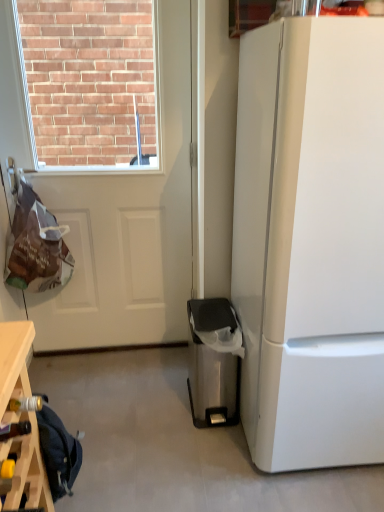
In order to face wooden wine rack at lower left, should I rotate leftwards or rightwards?

It's best to rotate left around 19.871 degrees.

I want to click on white matte door at upper left, so click(x=128, y=225).

You are a GUI agent. You are given a task and a screenshot of the screen. Output one action in this format:
    pyautogui.click(x=<x>, y=<y>)
    Task: Click on the stainless steel trash can at lower right
    The height and width of the screenshot is (512, 384).
    Given the screenshot: What is the action you would take?
    pyautogui.click(x=214, y=361)

Between white matte door at upper left and wooden wine rack at lower left, which one has smaller size?

Smaller between the two is wooden wine rack at lower left.

Locate an element on the screen. Image resolution: width=384 pixels, height=512 pixels. door behind the wooden wine rack at lower left is located at coordinates (128, 225).

Is white matte door at upper left at the right side of wooden wine rack at lower left?

Correct, you'll find white matte door at upper left to the right of wooden wine rack at lower left.

Can we say white matte door at upper left lies outside wooden wine rack at lower left?

Yes.

From the image's perspective, who appears lower, stainless steel trash can at lower right or white matte door at upper left?

stainless steel trash can at lower right appears lower in the image.

Who is bigger, stainless steel trash can at lower right or white matte door at upper left?

With larger size is white matte door at upper left.

Is stainless steel trash can at lower right touching white matte door at upper left?

There is a gap between stainless steel trash can at lower right and white matte door at upper left.

Is the position of stainless steel trash can at lower right more distant than that of white matte door at upper left?

Yes, stainless steel trash can at lower right is behind white matte door at upper left.

How different are the orientations of wooden wine rack at lower left and white glossy refrigerator at right in degrees?

wooden wine rack at lower left and white glossy refrigerator at right are facing 179 degrees away from each other.

Is wooden wine rack at lower left situated inside white glossy refrigerator at right or outside?

wooden wine rack at lower left is located beyond the bounds of white glossy refrigerator at right.

The image size is (384, 512). I want to click on table below the white glossy refrigerator at right (from the image's perspective), so click(21, 420).

Are wooden wine rack at lower left and white glossy refrigerator at right far apart?

wooden wine rack at lower left is actually quite close to white glossy refrigerator at right.

Does white matte door at upper left have a lesser width compared to white glossy refrigerator at right?

Correct, the width of white matte door at upper left is less than that of white glossy refrigerator at right.

Who is smaller, white matte door at upper left or white glossy refrigerator at right?

white matte door at upper left.

Locate an element on the screen. This screenshot has width=384, height=512. door above the white glossy refrigerator at right (from a real-world perspective) is located at coordinates (128, 225).

Is white matte door at upper left further to camera compared to white glossy refrigerator at right?

Yes, white matte door at upper left is further from the viewer.

From the image's perspective, which one is positioned lower, stainless steel trash can at lower right or white glossy refrigerator at right?

From the image's view, stainless steel trash can at lower right is below.

Which point is more distant from viewer, (238, 409) or (295, 394)?

The point (238, 409) is more distant.

Considering the relative sizes of stainless steel trash can at lower right and white glossy refrigerator at right in the image provided, is stainless steel trash can at lower right shorter than white glossy refrigerator at right?

Correct, stainless steel trash can at lower right is not as tall as white glossy refrigerator at right.

How many degrees apart are the facing directions of white glossy refrigerator at right and white matte door at upper left?

The angle between the facing direction of white glossy refrigerator at right and the facing direction of white matte door at upper left is 0.00382 degrees.

Is white glossy refrigerator at right outside of white matte door at upper left?

white glossy refrigerator at right lies outside white matte door at upper left's area.

Between white glossy refrigerator at right and white matte door at upper left, which one has larger width?

With larger width is white glossy refrigerator at right.

From a real-world perspective, between white glossy refrigerator at right and white matte door at upper left, who is vertically higher?

In real-world perspective, white matte door at upper left is above.

Considering the positions of point (155, 284) and point (193, 354), is point (155, 284) closer or farther from the camera than point (193, 354)?

Point (155, 284) appears to be farther away from the viewer than point (193, 354).

Is white matte door at upper left next to stainless steel trash can at lower right?

white matte door at upper left and stainless steel trash can at lower right are clearly separated.

From the image's perspective, would you say white matte door at upper left is shown under stainless steel trash can at lower right?

Actually, white matte door at upper left appears above stainless steel trash can at lower right in the image.

Which of these two, white matte door at upper left or stainless steel trash can at lower right, is wider?

stainless steel trash can at lower right is wider.

You are a GUI agent. You are given a task and a screenshot of the screen. Output one action in this format:
    pyautogui.click(x=<x>, y=<y>)
    Task: Click on the door that appears behind the wooden wine rack at lower left
    The width and height of the screenshot is (384, 512).
    Given the screenshot: What is the action you would take?
    pyautogui.click(x=128, y=225)

Identify the location of trash bin/can below the white matte door at upper left (from the image's perspective). (214, 361).

Considering their positions, is white glossy refrigerator at right positioned further to wooden wine rack at lower left than stainless steel trash can at lower right?

white glossy refrigerator at right is further to wooden wine rack at lower left.

Looking at the image, which one is located closer to white glossy refrigerator at right, stainless steel trash can at lower right or wooden wine rack at lower left?

stainless steel trash can at lower right is closer to white glossy refrigerator at right.

Based on their spatial positions, is white matte door at upper left or white glossy refrigerator at right further from wooden wine rack at lower left?

white matte door at upper left is positioned further to the anchor wooden wine rack at lower left.

Based on their spatial positions, is white matte door at upper left or stainless steel trash can at lower right further from wooden wine rack at lower left?

white matte door at upper left is positioned further to the anchor wooden wine rack at lower left.

When comparing their distances from wooden wine rack at lower left, does stainless steel trash can at lower right or white matte door at upper left seem closer?

Based on the image, stainless steel trash can at lower right appears to be nearer to wooden wine rack at lower left.

Estimate the real-world distances between objects in this image. Which object is further from white glossy refrigerator at right, wooden wine rack at lower left or white matte door at upper left?

white matte door at upper left.

From the image, which object appears to be nearer to white matte door at upper left, stainless steel trash can at lower right or wooden wine rack at lower left?

Based on the image, stainless steel trash can at lower right appears to be nearer to white matte door at upper left.

Looking at the image, which one is located closer to white matte door at upper left, white glossy refrigerator at right or stainless steel trash can at lower right?

Among the two, stainless steel trash can at lower right is located nearer to white matte door at upper left.

This screenshot has width=384, height=512. I want to click on door located between wooden wine rack at lower left and white glossy refrigerator at right in the left-right direction, so pos(128,225).

Image resolution: width=384 pixels, height=512 pixels. In order to click on trash bin/can between white matte door at upper left and wooden wine rack at lower left vertically in this screenshot , I will do `click(214, 361)`.

Locate an element on the screen. trash bin/can between white matte door at upper left and white glossy refrigerator at right in the horizontal direction is located at coordinates (214, 361).

What are the coordinates of `trash bin/can situated between wooden wine rack at lower left and white glossy refrigerator at right from left to right` in the screenshot? It's located at (214, 361).